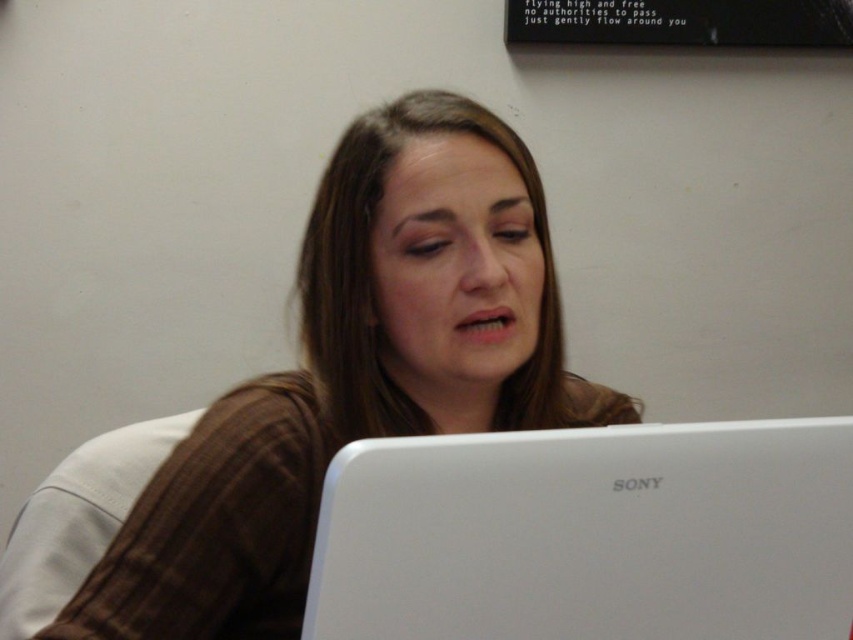
Question: Does brown textured shirt at center have a greater width compared to white matte laptop at lower center?

Choices:
 (A) no
 (B) yes

Answer: (B)

Question: Where is brown textured shirt at center located in relation to white matte laptop at lower center in the image?

Choices:
 (A) left
 (B) right

Answer: (A)

Question: Which point is farther from the camera taking this photo?

Choices:
 (A) (433, 496)
 (B) (309, 406)

Answer: (B)

Question: Can you confirm if brown textured shirt at center is positioned above white matte laptop at lower center?

Choices:
 (A) yes
 (B) no

Answer: (A)